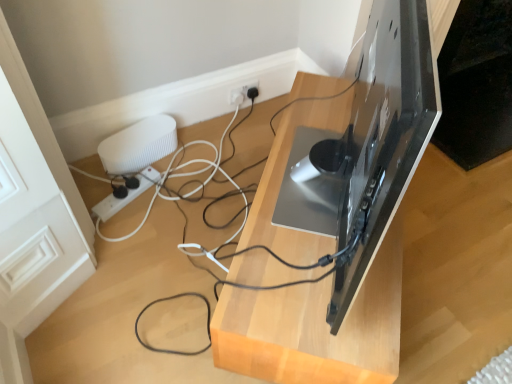
The height and width of the screenshot is (384, 512). What are the coordinates of `unoccupied region to the right of matte black tv stand at center` in the screenshot? It's located at (450, 251).